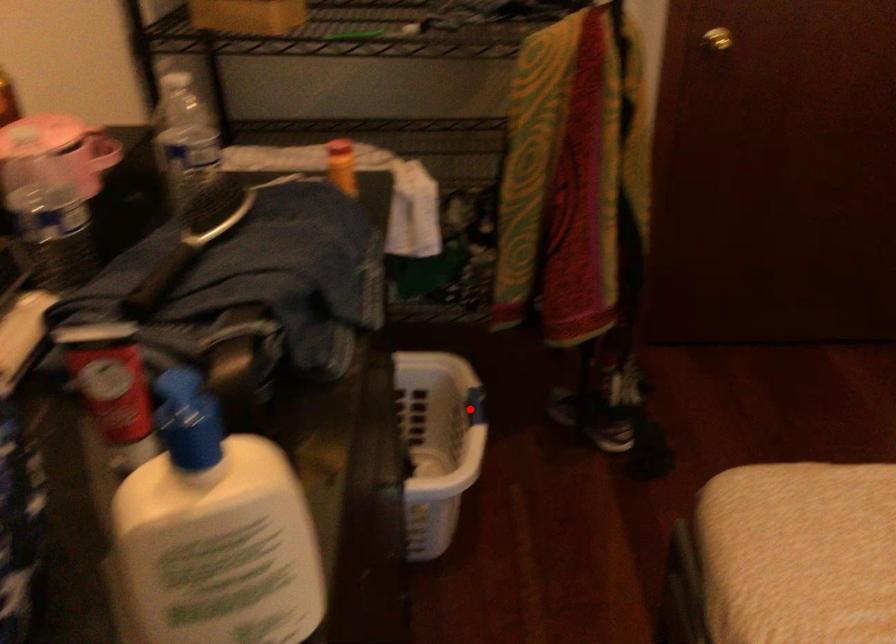
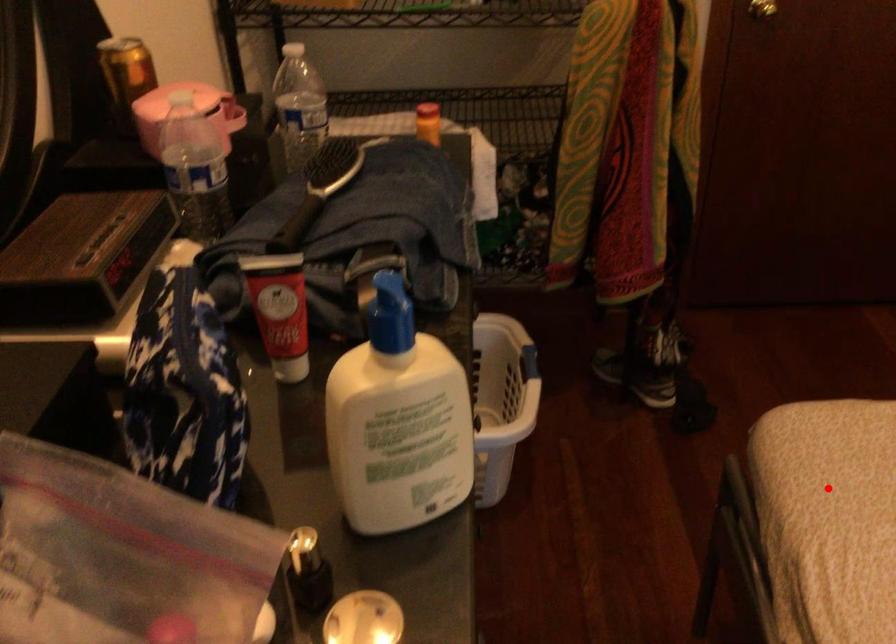
I am providing you with two images of the same scene from different viewpoints. A red point is marked on the first image and another point is marked on the second image. Is the marked point in image1 the same physical position as the marked point in image2?

No